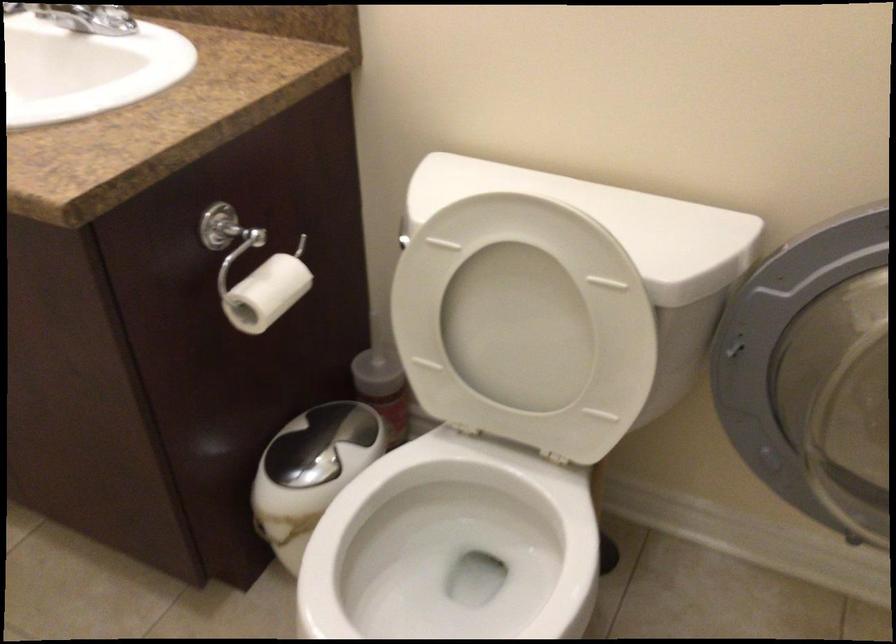
You are a GUI agent. You are given a task and a screenshot of the screen. Output one action in this format:
    pyautogui.click(x=<x>, y=<y>)
    Task: Click on the toilet brush handle
    Image resolution: width=896 pixels, height=644 pixels.
    Given the screenshot: What is the action you would take?
    pyautogui.click(x=380, y=330)